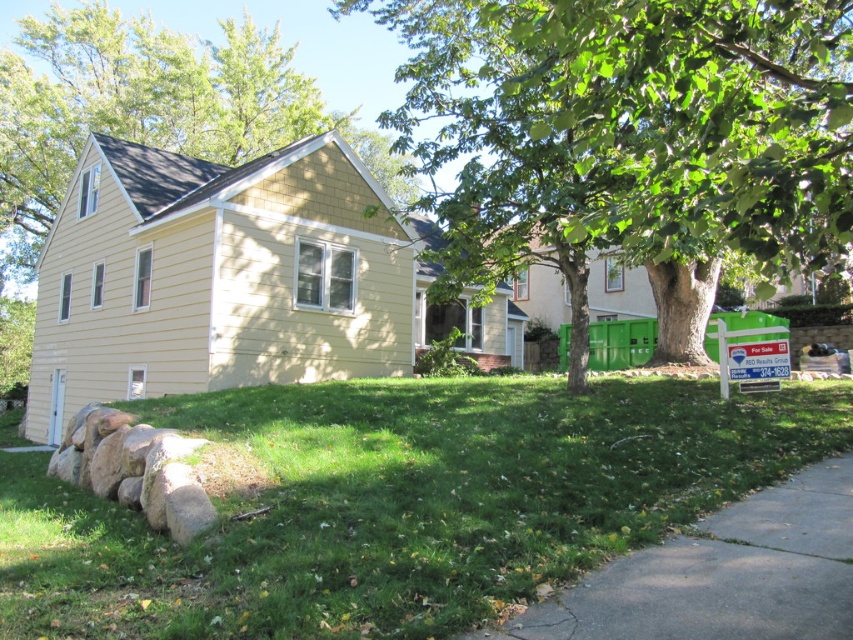
Question: Does green leafy tree at center have a greater width compared to gray concrete pavement at lower right?

Choices:
 (A) no
 (B) yes

Answer: (B)

Question: Which point is farther to the camera?

Choices:
 (A) green leafy tree at center
 (B) gray concrete pavement at lower right
 (C) green grass at lower center

Answer: (C)

Question: Is green grass at lower center in front of green leafy tree at center?

Choices:
 (A) no
 (B) yes

Answer: (A)

Question: Which point is closer to the camera?

Choices:
 (A) (483, 428)
 (B) (666, 141)

Answer: (B)

Question: In this image, where is green leafy tree at center located relative to gray concrete pavement at lower right?

Choices:
 (A) above
 (B) below

Answer: (A)

Question: Which object appears closest to the camera in this image?

Choices:
 (A) green leafy tree at center
 (B) gray concrete pavement at lower right

Answer: (A)